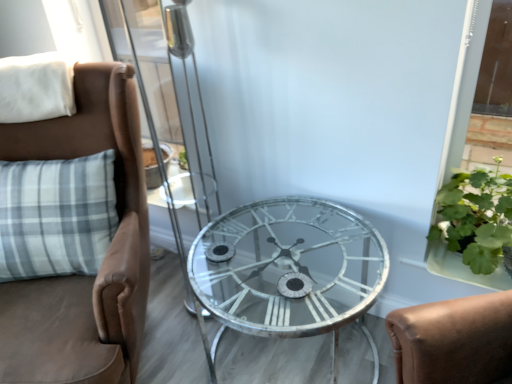
Question: From the image's perspective, would you say clear glass table at center is positioned over green leafy plant at right?

Choices:
 (A) no
 (B) yes

Answer: (A)

Question: From a real-world perspective, does clear glass table at center stand above green leafy plant at right?

Choices:
 (A) yes
 (B) no

Answer: (B)

Question: Can you confirm if clear glass table at center is taller than green leafy plant at right?

Choices:
 (A) no
 (B) yes

Answer: (B)

Question: Is clear glass table at center outside green leafy plant at right?

Choices:
 (A) yes
 (B) no

Answer: (A)

Question: Does clear glass table at center have a lesser width compared to green leafy plant at right?

Choices:
 (A) yes
 (B) no

Answer: (B)

Question: Can you confirm if clear glass table at center is bigger than green leafy plant at right?

Choices:
 (A) no
 (B) yes

Answer: (B)

Question: Can you confirm if green leafy plant at right is thinner than brown leather chair at left?

Choices:
 (A) no
 (B) yes

Answer: (B)

Question: Is the position of green leafy plant at right more distant than that of brown leather chair at left?

Choices:
 (A) no
 (B) yes

Answer: (B)

Question: Does green leafy plant at right have a larger size compared to brown leather chair at left?

Choices:
 (A) no
 (B) yes

Answer: (A)

Question: From a real-world perspective, is green leafy plant at right positioned over brown leather chair at left based on gravity?

Choices:
 (A) yes
 (B) no

Answer: (A)

Question: Does green leafy plant at right appear on the left side of brown leather chair at left?

Choices:
 (A) no
 (B) yes

Answer: (A)

Question: Would you say brown leather chair at left is part of green leafy plant at right's contents?

Choices:
 (A) no
 (B) yes

Answer: (A)

Question: Does green leafy plant at right have a larger size compared to white soft pillow at upper left?

Choices:
 (A) no
 (B) yes

Answer: (B)